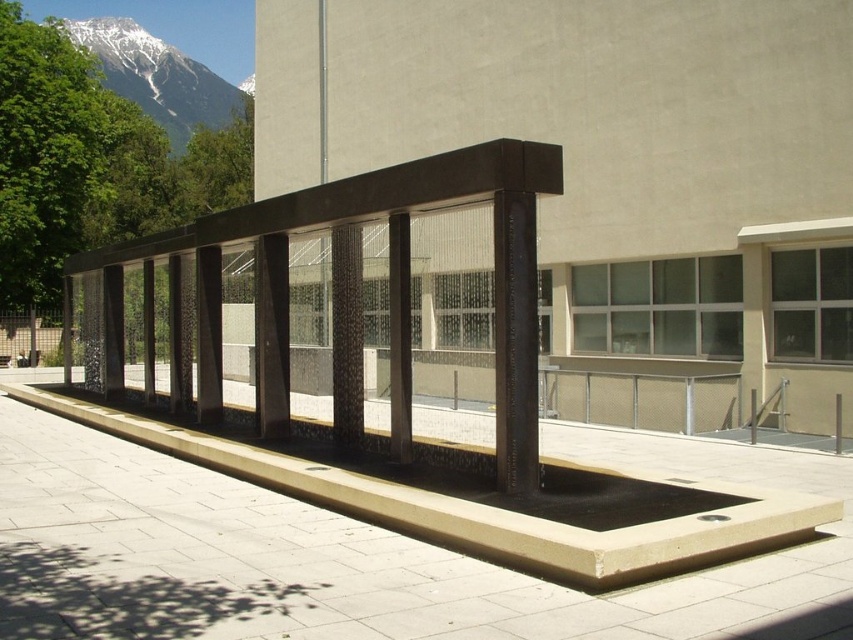
How much distance is there between black textured rail at center and snowy granite mountain at upper left?

A distance of 38.44 meters exists between black textured rail at center and snowy granite mountain at upper left.

Does point (97, 323) come behind point (143, 49)?

No, it is not.

Locate an element on the screen. black textured rail at center is located at coordinates (332, 298).

The height and width of the screenshot is (640, 853). I want to click on black textured rail at center, so click(332, 298).